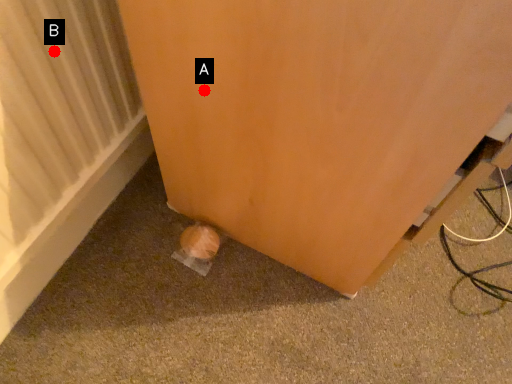
Question: Two points are circled on the image, labeled by A and B beside each circle. Among these points, which one is nearest to the camera?

Choices:
 (A) A is closer
 (B) B is closer

Answer: (A)